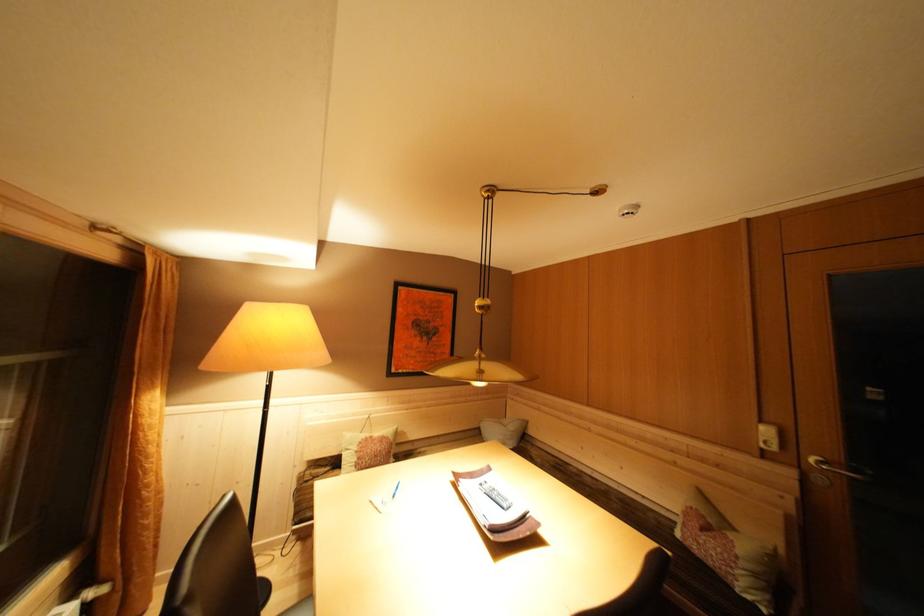
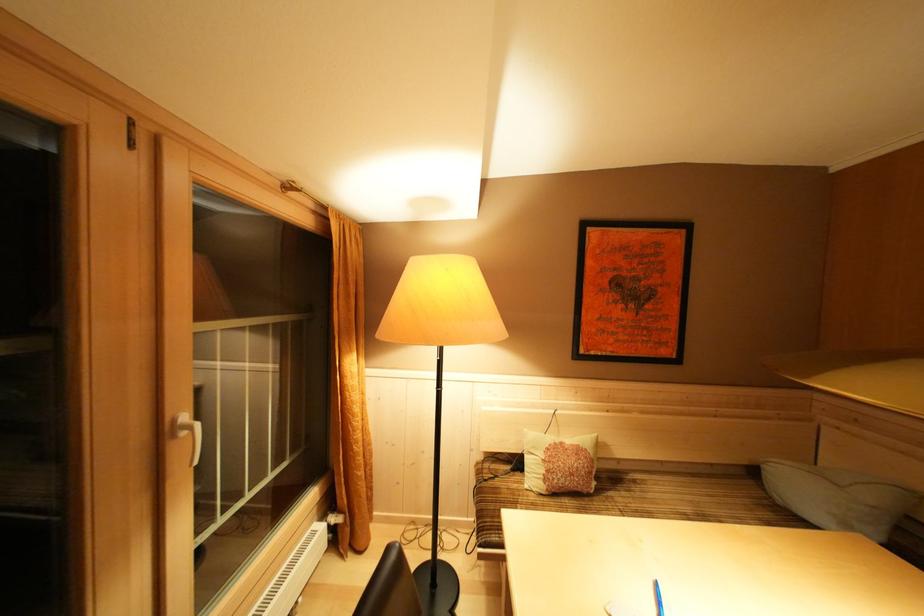
Find the pixel in the second image that matches the point at 470,437 in the first image.

(718, 468)